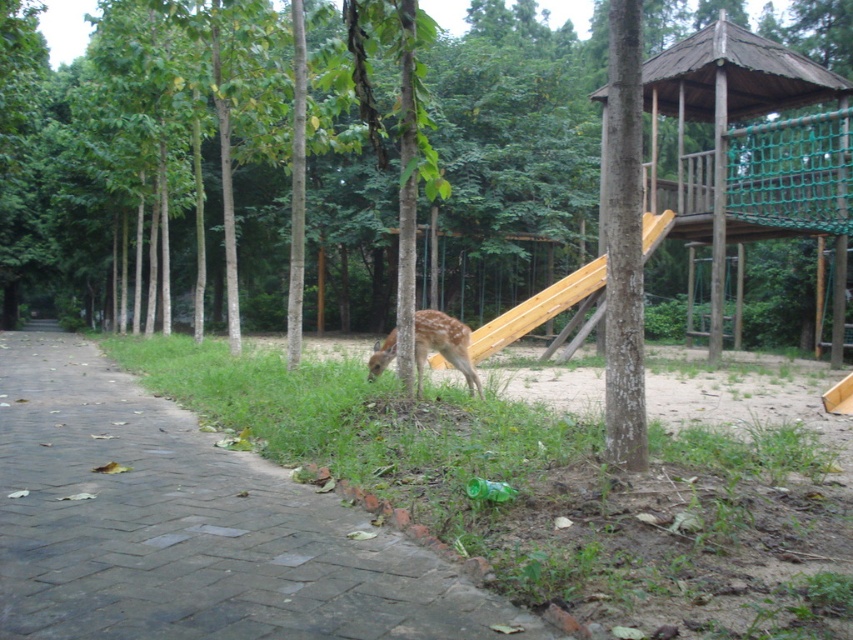
Question: Which object is positioned farthest from the brick paved path at center?

Choices:
 (A) fawn fur deer at center
 (B) wooden smooth slide at center
 (C) brown rough tree at center

Answer: (C)

Question: In this image, where is brown rough tree at center located relative to wooden smooth slide at center?

Choices:
 (A) below
 (B) above

Answer: (B)

Question: Which point appears farthest from the camera in this image?

Choices:
 (A) (476, 349)
 (B) (363, 616)
 (C) (171, 102)

Answer: (C)

Question: Is brick paved path at center positioned behind fawn fur deer at center?

Choices:
 (A) yes
 (B) no

Answer: (B)

Question: Does brick paved path at center appear on the right side of wooden smooth slide at center?

Choices:
 (A) yes
 (B) no

Answer: (B)

Question: Estimate the real-world distances between objects in this image. Which object is closer to the brick paved path at center?

Choices:
 (A) wooden smooth slide at center
 (B) brown rough tree at center
 (C) fawn fur deer at center

Answer: (C)